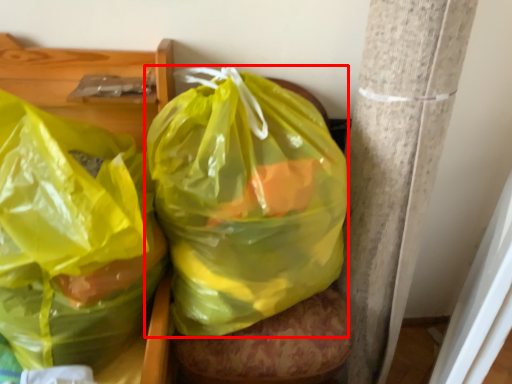
Question: Where is plastic bag (annotated by the red box) located in relation to plastic bag in the image?

Choices:
 (A) right
 (B) left

Answer: (A)